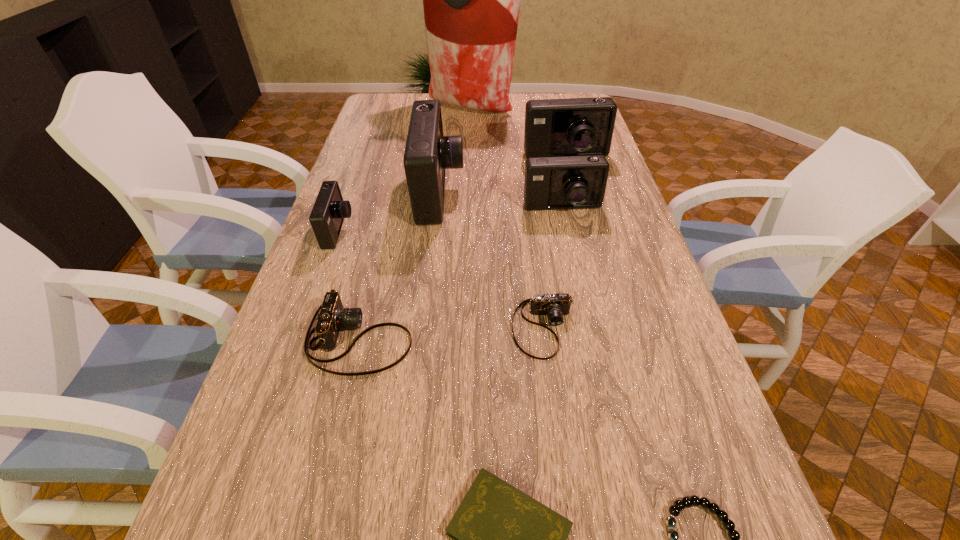
Image resolution: width=960 pixels, height=540 pixels. I want to click on vacant region between the third shortest object and the tallest camera, so click(492, 261).

This screenshot has width=960, height=540. What are the coordinates of `object identified as the fourth closest to the tallest object` in the screenshot? It's located at (329, 210).

Locate which object ranks fourth in proximity to the tallest camera. Please provide its 2D coordinates. Your answer should be formatted as a tuple, i.e. [(x, y)], where the tuple contains the x and y coordinates of a point satisfying the conditions above.

[(333, 317)]

This screenshot has height=540, width=960. Identify the location of the third closest camera to the third shortest object. (573, 182).

Image resolution: width=960 pixels, height=540 pixels. In order to click on camera that can be found as the fourth closest to the third tallest object in this screenshot , I will do `click(556, 305)`.

Where is `the closest blue camera to the fifth shortest camera`? This screenshot has width=960, height=540. the closest blue camera to the fifth shortest camera is located at coordinates (573, 182).

Identify the location of blue camera that is the second closest one to the sixth shortest object. This screenshot has height=540, width=960. (428, 153).

This screenshot has height=540, width=960. In order to click on vacant space that satisfies the following two spatial constraints: 1. on the front-facing side of the shortest camera; 2. on the front-facing side of the left brown camera in this screenshot , I will do `click(545, 339)`.

The image size is (960, 540). Identify the location of vacant space that satisfies the following two spatial constraints: 1. on the front-facing side of the fourth shortest camera; 2. on the front-facing side of the left brown camera. (590, 339).

Image resolution: width=960 pixels, height=540 pixels. I want to click on free space that satisfies the following two spatial constraints: 1. on the front-facing side of the second smallest blue camera; 2. on the front-facing side of the left brown camera, so click(x=590, y=339).